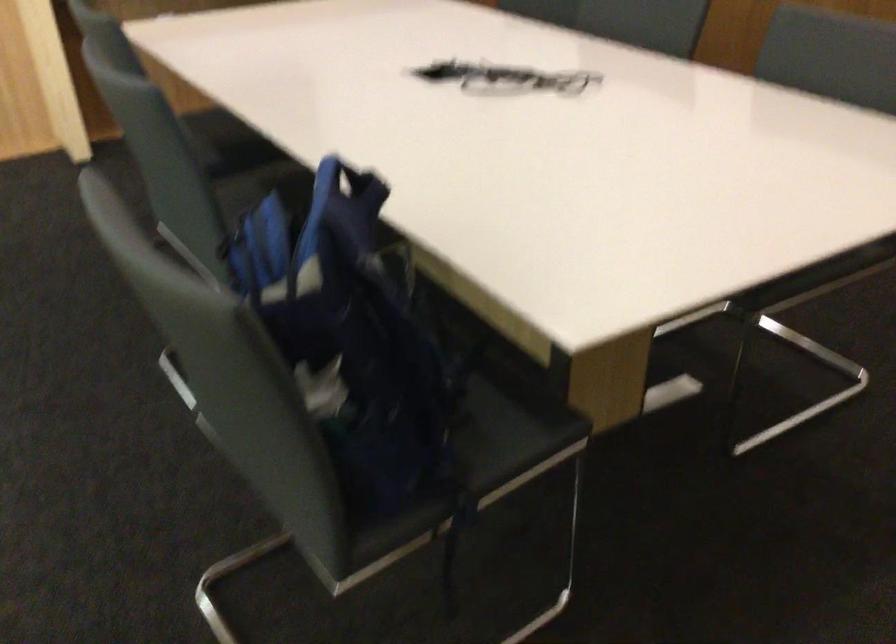
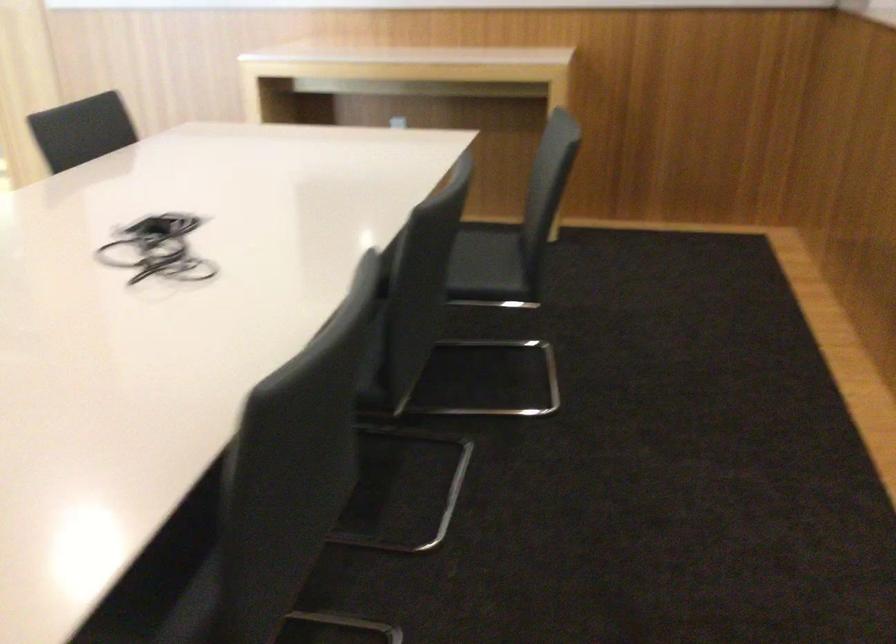
Where in the second image is the point corresponding to (x=488, y=87) from the first image?

(158, 249)